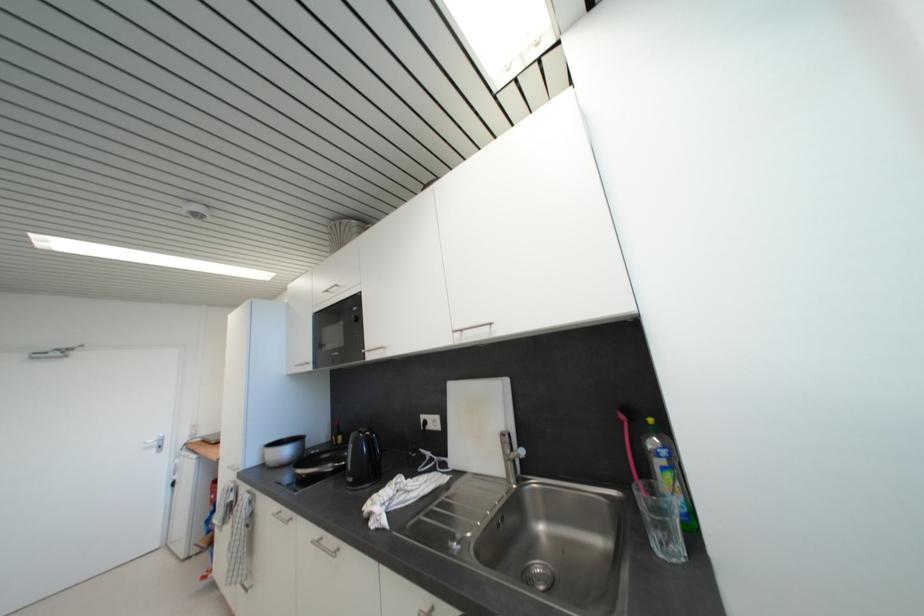
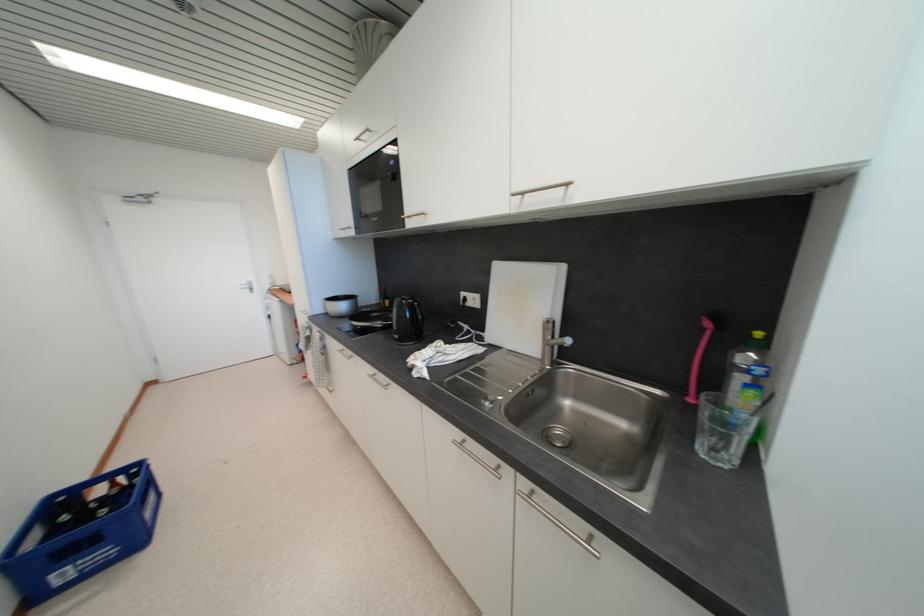
Question: I am providing you with two images of the same scene from different viewpoints. Please identify which objects are invisible in image2.

Choices:
 (A) black kettle handle
 (B) glass tumbler
 (C) dish soap bottle
 (D) none of these

Answer: (D)